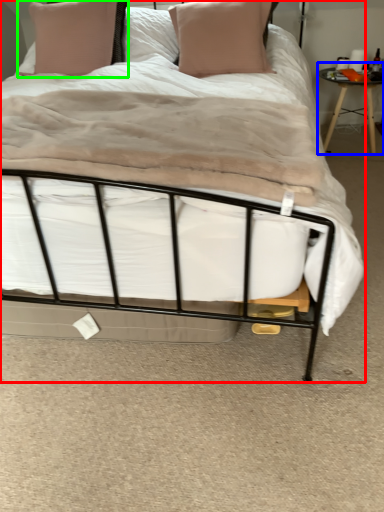
Question: Which object is the farthest from bed (highlighted by a red box)? Choose among these: table (highlighted by a blue box) or pillow (highlighted by a green box).

Choices:
 (A) table
 (B) pillow

Answer: (A)